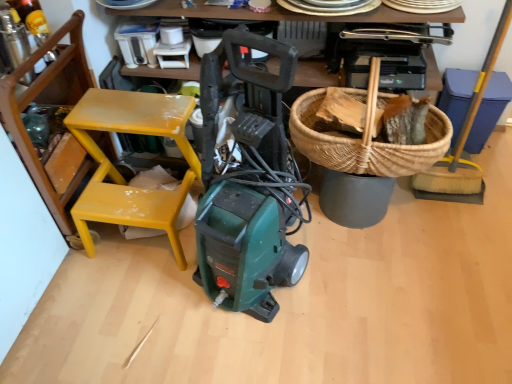
Question: Can you confirm if yellow-bristled broom at right is wider than yellow painted wood chair at left?

Choices:
 (A) yes
 (B) no

Answer: (B)

Question: Does yellow-bristled broom at right come in front of yellow painted wood chair at left?

Choices:
 (A) no
 (B) yes

Answer: (A)

Question: From a real-world perspective, is yellow-bristled broom at right under yellow painted wood chair at left?

Choices:
 (A) yes
 (B) no

Answer: (B)

Question: From a real-world perspective, is yellow-bristled broom at right located higher than yellow painted wood chair at left?

Choices:
 (A) no
 (B) yes

Answer: (B)

Question: From the image's perspective, is yellow-bristled broom at right below yellow painted wood chair at left?

Choices:
 (A) yes
 (B) no

Answer: (B)

Question: Considering the relative sizes of yellow-bristled broom at right and yellow painted wood chair at left in the image provided, is yellow-bristled broom at right thinner than yellow painted wood chair at left?

Choices:
 (A) yes
 (B) no

Answer: (A)

Question: Does woven brown basket at upper right have a larger size compared to yellow painted wood chair at left?

Choices:
 (A) yes
 (B) no

Answer: (B)

Question: Is there a large distance between woven brown basket at upper right and yellow painted wood chair at left?

Choices:
 (A) no
 (B) yes

Answer: (A)

Question: Is woven brown basket at upper right aimed at yellow painted wood chair at left?

Choices:
 (A) yes
 (B) no

Answer: (B)

Question: From a real-world perspective, does woven brown basket at upper right sit lower than yellow painted wood chair at left?

Choices:
 (A) yes
 (B) no

Answer: (B)

Question: Does woven brown basket at upper right appear on the right side of yellow painted wood chair at left?

Choices:
 (A) no
 (B) yes

Answer: (B)

Question: Is woven brown basket at upper right shorter than yellow painted wood chair at left?

Choices:
 (A) yes
 (B) no

Answer: (A)

Question: Is yellow-bristled broom at right positioned beyond the bounds of woven brown basket at upper right?

Choices:
 (A) yes
 (B) no

Answer: (A)